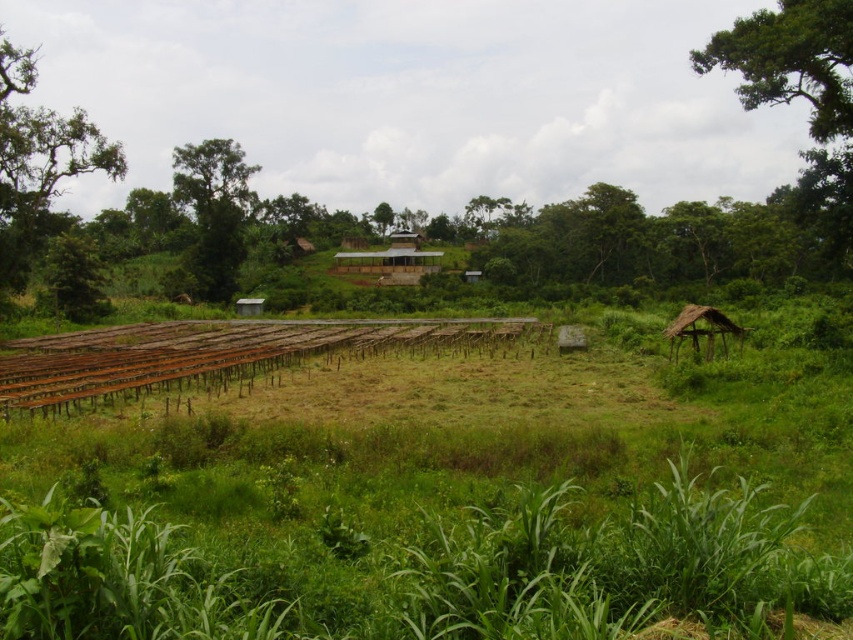
Question: Does rusty metal train track at center appear on the left side of green leafy tree at upper left?

Choices:
 (A) yes
 (B) no

Answer: (B)

Question: Which object is positioned closest to the green leafy tree at upper left?

Choices:
 (A) green leafy tree at left
 (B) thatched straw hut at right

Answer: (A)

Question: Is green leafy tree at left to the left of green leafy tree at upper left from the viewer's perspective?

Choices:
 (A) no
 (B) yes

Answer: (A)

Question: Which of the following is the closest to the observer?

Choices:
 (A) (16, 362)
 (B) (351, 266)
 (C) (22, 193)
 (D) (683, 323)

Answer: (D)

Question: Based on their relative distances, which object is farther from the green leafy tree at left?

Choices:
 (A) brown thatched hut at center
 (B) thatched straw hut at right

Answer: (A)

Question: Is the position of green leafy tree at upper right more distant than that of thatched straw hut at right?

Choices:
 (A) yes
 (B) no

Answer: (B)